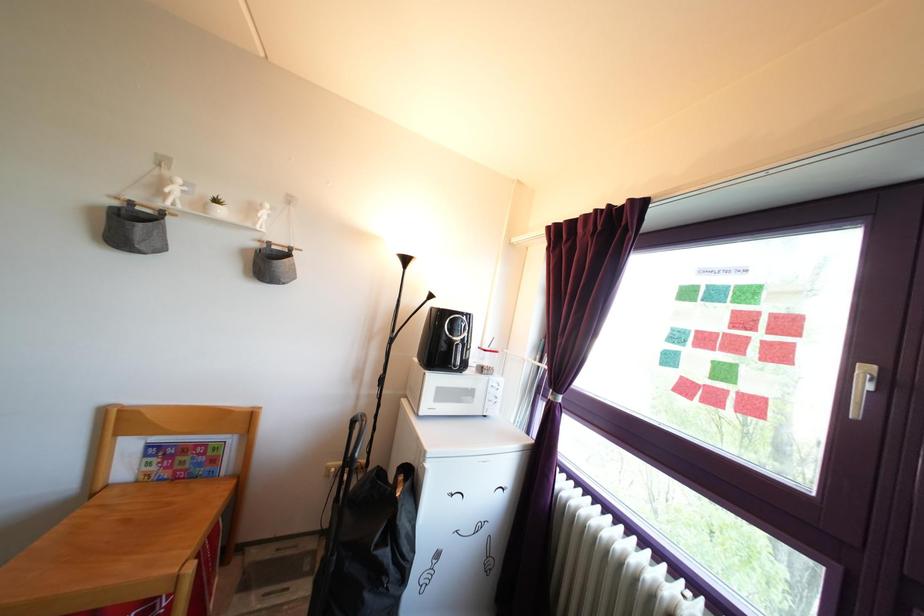
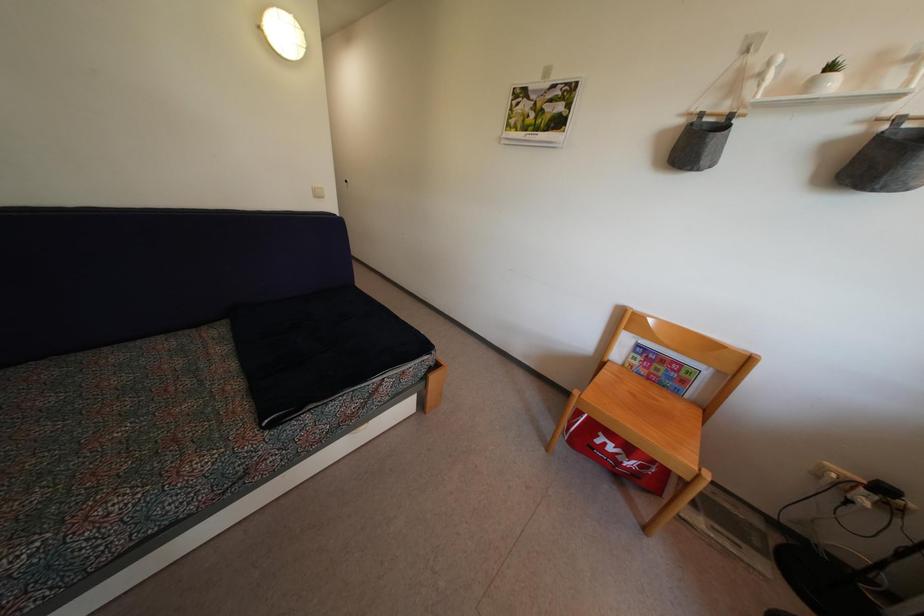
Locate, in the second image, the point that corresponds to pixel 169 483 in the first image.

(647, 381)